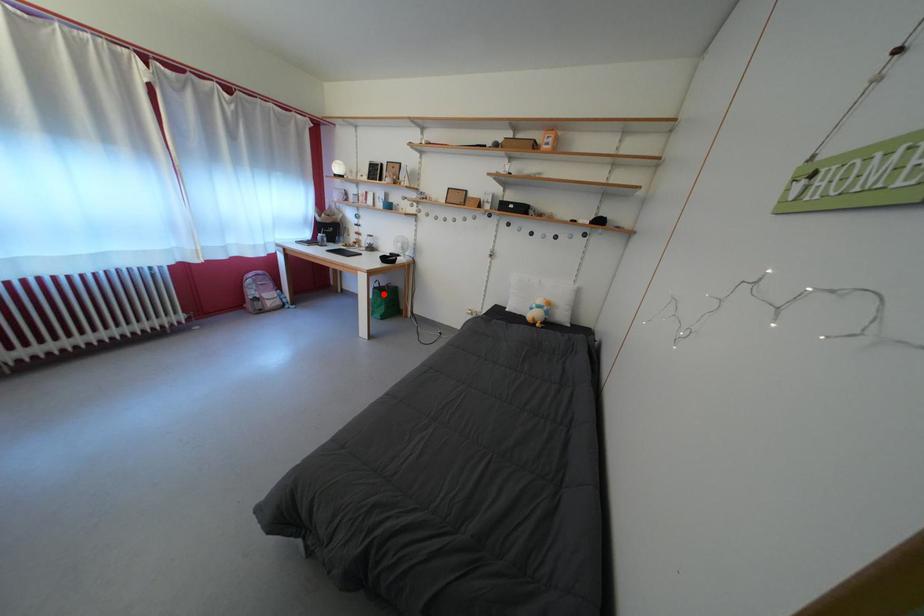
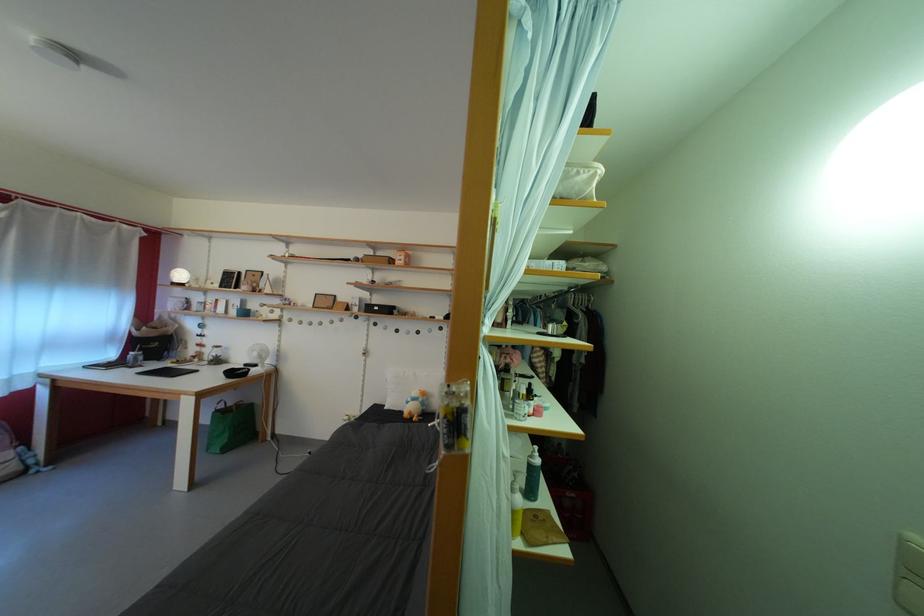
Find the pixel in the second image that matches the highlighted location in the first image.

(225, 416)